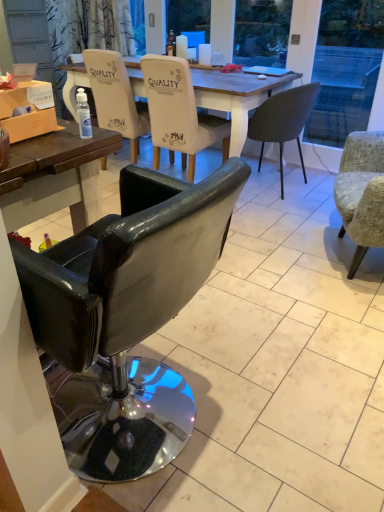
Identify the location of unoccupied space behind black leather chair at lower left, the fifth chair when ordered from back to front. (202, 329).